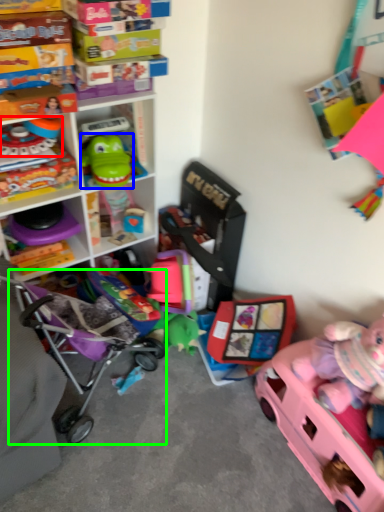
Question: Considering the real-world distances, which object is farthest from toy (highlighted by a red box)? toy (highlighted by a blue box) or baby carriage (highlighted by a green box)?

Choices:
 (A) toy
 (B) baby carriage

Answer: (B)